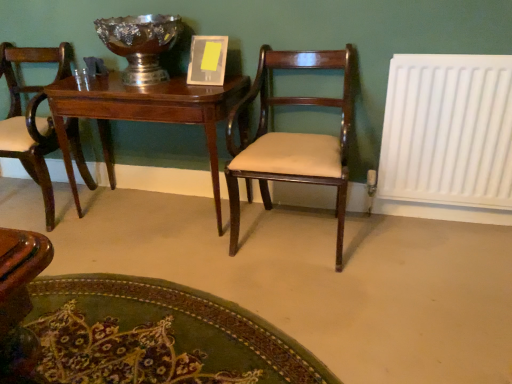
Where is `vacant region under mahogany wood table at center (from a real-world perspective)`? Image resolution: width=512 pixels, height=384 pixels. vacant region under mahogany wood table at center (from a real-world perspective) is located at coordinates (156, 211).